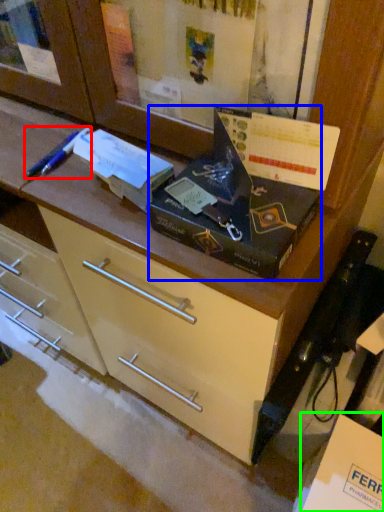
Question: Which object is positioned farthest from penguin (highlighted by a red box)? Select from box (highlighted by a blue box) and cardboard box (highlighted by a green box).

Choices:
 (A) box
 (B) cardboard box

Answer: (B)